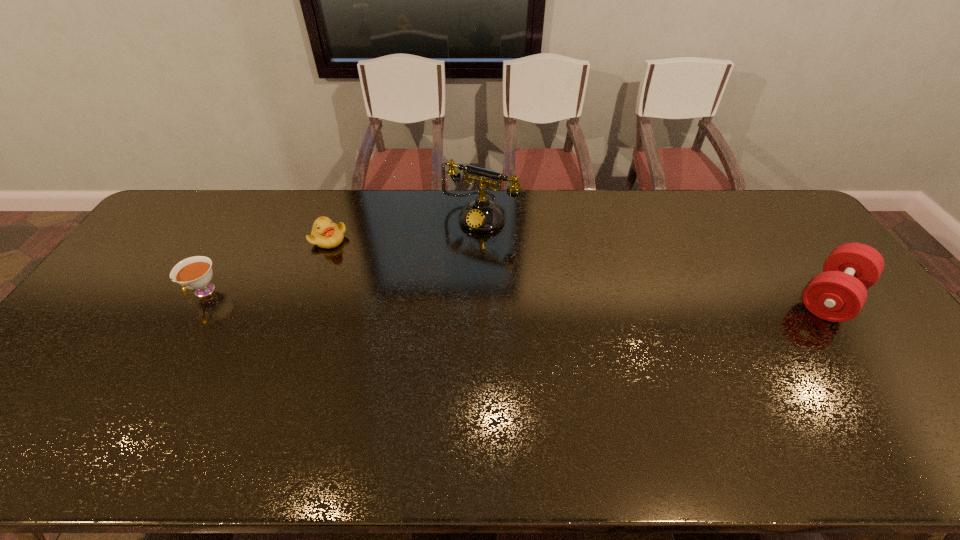
This screenshot has height=540, width=960. I want to click on unoccupied area between the teacup and the tallest object, so click(x=342, y=254).

Where is `unoccupied area between the third shortest object and the telephone`? The image size is (960, 540). unoccupied area between the third shortest object and the telephone is located at coordinates (656, 256).

I want to click on object that is the closest to the third object from left to right, so (325, 234).

Find the location of a particular element. This screenshot has width=960, height=540. object that is the closest to the dumbbell is located at coordinates pyautogui.click(x=482, y=215).

Identify the location of vacant position in the image that satisfies the following two spatial constraints: 1. on the front side of the dumbbell; 2. on the left side of the duckling. (308, 296).